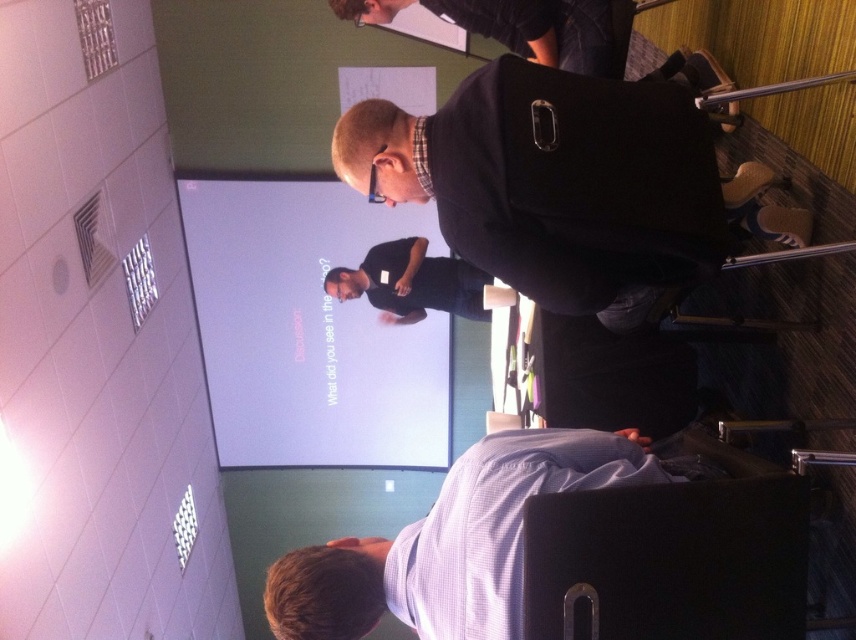
Question: Among these objects, which one is nearest to the camera?

Choices:
 (A) black fabric bag at upper center
 (B) black matte shirt at center
 (C) matte black jacket at center

Answer: (C)

Question: Can you confirm if white glossy projector screen at upper center is positioned to the left of light blue shirt at lower center?

Choices:
 (A) yes
 (B) no

Answer: (A)

Question: Which point is closer to the camera taking this photo?

Choices:
 (A) (669, 616)
 (B) (406, 312)

Answer: (A)

Question: Which of the following is the closest to the observer?

Choices:
 (A) (417, 241)
 (B) (581, 577)
 (C) (247, 236)

Answer: (B)

Question: Is matte black jacket at center bigger than black leather chair at lower right?

Choices:
 (A) no
 (B) yes

Answer: (B)

Question: Is the position of white glossy projector screen at upper center more distant than that of light blue shirt at lower center?

Choices:
 (A) yes
 (B) no

Answer: (A)